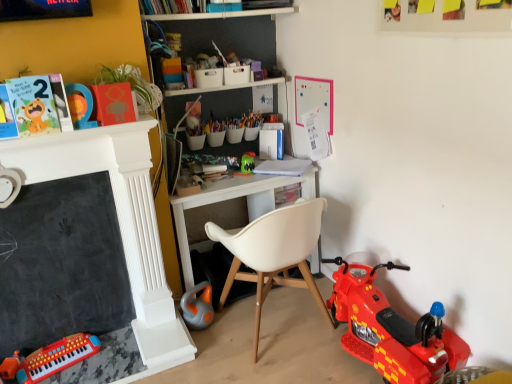
Locate an element on the screen. black chalkboard at left is located at coordinates (119, 223).

Describe the element at coordinates (236, 198) in the screenshot. I see `white plastic desk at center` at that location.

This screenshot has width=512, height=384. What are the coordinates of `white matte chair at center` in the screenshot? It's located at (274, 253).

This screenshot has width=512, height=384. Identify the location of matte plastic number at upper left, marked as the third toy in a left-to-right arrangement. (80, 105).

From the picture: What is the approximate width of orange plastic toy at lower center, which ranks as the 3th toy in right-to-left order?

orange plastic toy at lower center, which ranks as the 3th toy in right-to-left order, is 6.15 inches in width.

Locate an element on the screen. black chalkboard at left is located at coordinates (119, 223).

Can you confirm if matte paper card at upper left, which is the 3th book from back to front, is shorter than plastic keyboard at lower left, which ranks as the 2th toy in left-to-right order?

Incorrect, the height of matte paper card at upper left, which is the 3th book from back to front, does not fall short of that of plastic keyboard at lower left, which ranks as the 2th toy in left-to-right order.

Based on the photo, relative to plastic keyboard at lower left, which ranks as the 2th toy in left-to-right order, is matte paper card at upper left, which appears as the 3th book when viewed from the right, in front or behind?

Clearly, matte paper card at upper left, which appears as the 3th book when viewed from the right, is in front of plastic keyboard at lower left, which ranks as the 2th toy in left-to-right order.

Can you confirm if matte paper card at upper left, which is the 3th book from back to front, is smaller than plastic keyboard at lower left, which ranks as the 2th toy in left-to-right order?

Yes, matte paper card at upper left, which is the 3th book from back to front, is smaller than plastic keyboard at lower left, which ranks as the 2th toy in left-to-right order.

From the image's perspective, between matte orange book at upper left, which is counted as the second book, starting from the right, and shiny plastic toy motorcycle at lower right, positioned as the first toy in right-to-left order, who is located below?

From the image's view, shiny plastic toy motorcycle at lower right, positioned as the first toy in right-to-left order, is below.

Locate an element on the screen. Image resolution: width=512 pixels, height=384 pixels. the 2nd book counting from the left side of the shiny plastic toy motorcycle at lower right, positioned as the first toy in right-to-left order is located at coordinates (113, 104).

Is matte orange book at upper left, placed as the second book when sorted from left to right, oriented towards shiny plastic toy motorcycle at lower right, positioned as the first toy in right-to-left order?

No, matte orange book at upper left, placed as the second book when sorted from left to right, is not aimed at shiny plastic toy motorcycle at lower right, positioned as the first toy in right-to-left order.

Which of these two, matte plastic number at upper left, the fourth toy from the right, or rubberized plastic toy piano at lower left, acting as the first toy starting from the left, stands taller?

matte plastic number at upper left, the fourth toy from the right, is taller.

Choose the correct answer: Is matte plastic number at upper left, the fourth toy from the right, inside rubberized plastic toy piano at lower left, which appears as the sixth toy when viewed from the right, or outside it?

matte plastic number at upper left, the fourth toy from the right, is spatially situated outside rubberized plastic toy piano at lower left, which appears as the sixth toy when viewed from the right.

From the picture: Would you consider matte plastic number at upper left, the fourth toy from the right, to be distant from rubberized plastic toy piano at lower left, which appears as the sixth toy when viewed from the right?

Yes, matte plastic number at upper left, the fourth toy from the right, is far from rubberized plastic toy piano at lower left, which appears as the sixth toy when viewed from the right.

Between point (85, 86) and point (14, 363), which one is positioned in front?

Positioned in front is point (85, 86).

Is shiny plastic toy motorcycle at lower right, the 6th toy in the left-to-right sequence, surrounding matte orange book at upper left, which is counted as the second book, starting from the right?

No, matte orange book at upper left, which is counted as the second book, starting from the right, is located outside of shiny plastic toy motorcycle at lower right, the 6th toy in the left-to-right sequence.

Is shiny plastic toy motorcycle at lower right, the 6th toy in the left-to-right sequence, positioned with its back to matte orange book at upper left, which is the second book in back-to-front order?

No, matte orange book at upper left, which is the second book in back-to-front order, is not at the back of shiny plastic toy motorcycle at lower right, the 6th toy in the left-to-right sequence.

From a real-world perspective, is shiny plastic toy motorcycle at lower right, the 6th toy in the left-to-right sequence, on matte orange book at upper left, which is the second book in back-to-front order?

No, from a real-world perspective, shiny plastic toy motorcycle at lower right, the 6th toy in the left-to-right sequence, is not on top of matte orange book at upper left, which is the second book in back-to-front order.

From the image's perspective, does shiny plastic toy motorcycle at lower right, the 6th toy in the left-to-right sequence, appear higher than matte orange book at upper left, which is counted as the second book, starting from the front?

Actually, shiny plastic toy motorcycle at lower right, the 6th toy in the left-to-right sequence, appears below matte orange book at upper left, which is counted as the second book, starting from the front, in the image.

From a real-world perspective, is matte orange book at upper left, which is counted as the second book, starting from the front, above or below green plastic toy at center, the fifth toy from the left?

matte orange book at upper left, which is counted as the second book, starting from the front, is situated higher than green plastic toy at center, the fifth toy from the left, in the real world.

Is matte orange book at upper left, which is counted as the second book, starting from the front, wider than green plastic toy at center, the fifth toy from the left?

No.

Does point (103, 111) appear closer or farther from the camera than point (246, 155)?

Point (103, 111) is positioned closer to the camera compared to point (246, 155).

Is matte orange book at upper left, placed as the second book when sorted from left to right, located outside green plastic toy at center, marked as the second toy in a right-to-left arrangement?

matte orange book at upper left, placed as the second book when sorted from left to right, is positioned outside green plastic toy at center, marked as the second toy in a right-to-left arrangement.

Considering the sizes of objects matte paper card at upper left, arranged as the first book when viewed from the left, and rubberized plastic toy piano at lower left, acting as the first toy starting from the left, in the image provided, who is shorter, matte paper card at upper left, arranged as the first book when viewed from the left, or rubberized plastic toy piano at lower left, acting as the first toy starting from the left,?

rubberized plastic toy piano at lower left, acting as the first toy starting from the left, is shorter.

Could you tell me if matte paper card at upper left, which appears as the 3th book when viewed from the right, is facing rubberized plastic toy piano at lower left, acting as the first toy starting from the left?

No.

From the image's perspective, is matte paper card at upper left, which appears as the 3th book when viewed from the right, over rubberized plastic toy piano at lower left, which appears as the sixth toy when viewed from the right?

Yes, from the image's perspective, matte paper card at upper left, which appears as the 3th book when viewed from the right, is on top of rubberized plastic toy piano at lower left, which appears as the sixth toy when viewed from the right.

How many degrees apart are the facing directions of matte paper card at upper left, arranged as the first book when viewed from the left, and rubberized plastic toy piano at lower left, acting as the first toy starting from the left?

matte paper card at upper left, arranged as the first book when viewed from the left, and rubberized plastic toy piano at lower left, acting as the first toy starting from the left, are facing 0.000232 degrees away from each other.

From the image's perspective, is green plastic toy at center, the fifth toy from the left, above or below white plastic desk at center?

green plastic toy at center, the fifth toy from the left, is above white plastic desk at center.

Between green plastic toy at center, the fifth toy from the left, and white plastic desk at center, which one has larger width?

white plastic desk at center.

Between green plastic toy at center, marked as the second toy in a right-to-left arrangement, and white plastic desk at center, which one has smaller size?

Smaller between the two is green plastic toy at center, marked as the second toy in a right-to-left arrangement.

How distant is green plastic toy at center, marked as the second toy in a right-to-left arrangement, from white plastic desk at center?

green plastic toy at center, marked as the second toy in a right-to-left arrangement, is 11.69 inches away from white plastic desk at center.

You are a GUI agent. You are given a task and a screenshot of the screen. Output one action in this format:
    pyautogui.click(x=<x>, y=<y>)
    Task: Click on the 2nd book in front of the plastic keyboard at lower left, which ranks as the 2th toy in left-to-right order
    This screenshot has width=512, height=384.
    Given the screenshot: What is the action you would take?
    pyautogui.click(x=39, y=104)

This screenshot has width=512, height=384. I want to click on the 3rd toy counting from the right side of the matte orange book at upper left, which is counted as the second book, starting from the right, so click(x=391, y=329).

Considering their positions, is black chalkboard at left positioned closer to green plastic toy at center, the fifth toy from the left, than matte plastic number at upper left, the fourth toy from the right?

Based on the image, black chalkboard at left appears to be nearer to green plastic toy at center, the fifth toy from the left.

Considering their positions, is rubberized plastic toy piano at lower left, acting as the first toy starting from the left, positioned further to black chalkboard at left than plastic keyboard at lower left, which ranks as the 2th toy in left-to-right order?

rubberized plastic toy piano at lower left, acting as the first toy starting from the left, lies further to black chalkboard at left than the other object.

Based on their spatial positions, is rubberized plastic toy piano at lower left, which appears as the sixth toy when viewed from the right, or green plastic toy at center, the fifth toy from the left, further from white matte chair at center?

Among the two, rubberized plastic toy piano at lower left, which appears as the sixth toy when viewed from the right, is located further to white matte chair at center.

Estimate the real-world distances between objects in this image. Which object is closer to green plastic toy at center, marked as the second toy in a right-to-left arrangement, rubberized plastic toy piano at lower left, which appears as the sixth toy when viewed from the right, or matte plastic number at upper left, the fourth toy from the right?

matte plastic number at upper left, the fourth toy from the right.

Looking at the image, which one is located closer to plastic keyboard at lower left, which ranks as the 2th toy in left-to-right order, black chalkboard at left or orange plastic toy at lower center, which ranks as the fourth toy in left-to-right order?

The object closer to plastic keyboard at lower left, which ranks as the 2th toy in left-to-right order, is black chalkboard at left.

Estimate the real-world distances between objects in this image. Which object is further from white paper at center, marked as the first book in a back-to-front arrangement, matte plastic number at upper left, the fourth toy from the right, or green plastic toy at center, the fifth toy from the left?

Based on the image, matte plastic number at upper left, the fourth toy from the right, appears to be further to white paper at center, marked as the first book in a back-to-front arrangement.

Which object lies further to the anchor point matte plastic number at upper left, marked as the third toy in a left-to-right arrangement, shiny plastic toy motorcycle at lower right, positioned as the first toy in right-to-left order, or plastic keyboard at lower left, the 5th toy from the right?

shiny plastic toy motorcycle at lower right, positioned as the first toy in right-to-left order, lies further to matte plastic number at upper left, marked as the third toy in a left-to-right arrangement, than the other object.

Estimate the real-world distances between objects in this image. Which object is closer to black chalkboard at left, green plastic toy at center, marked as the second toy in a right-to-left arrangement, or matte plastic number at upper left, marked as the third toy in a left-to-right arrangement?

matte plastic number at upper left, marked as the third toy in a left-to-right arrangement.

The image size is (512, 384). What are the coordinates of `book between matte orange book at upper left, which is counted as the second book, starting from the front, and green plastic toy at center, marked as the second toy in a right-to-left arrangement, along the z-axis` in the screenshot? It's located at (283, 167).

Find the location of a particular element. book located between matte plastic number at upper left, the fourth toy from the right, and white matte chair at center in the left-right direction is located at coordinates (113, 104).

I want to click on shelf situated between matte orange book at upper left, placed as the second book when sorted from left to right, and shiny plastic toy motorcycle at lower right, positioned as the first toy in right-to-left order, from left to right, so click(236, 198).

This screenshot has height=384, width=512. In order to click on fireplace situated between rubberized plastic toy piano at lower left, acting as the first toy starting from the left, and white paper at center, which is the 3th book in left-to-right order, from left to right in this screenshot , I will do `click(119, 223)`.